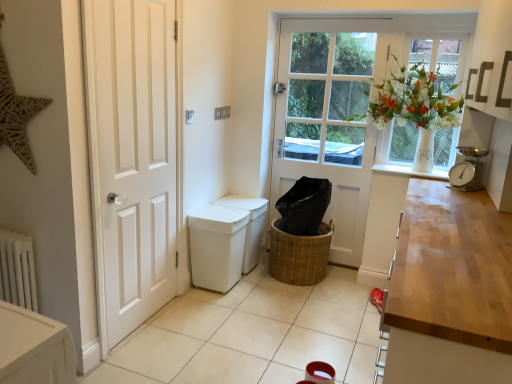
What is the approximate height of silver metallic scale at right?

It is 9.92 inches.

What do you see at coordinates (132, 157) in the screenshot? I see `white glossy door at left, the second door viewed from the right` at bounding box center [132, 157].

In order to face white glossy door at left, which ranks as the 1th door in left-to-right order, should I rotate leftwards or rightwards?

You should rotate left by 14.594 degrees.

Identify the location of white glass window at upper right. (421, 104).

Where is `woven brown basket at center`? The image size is (512, 384). woven brown basket at center is located at coordinates (298, 255).

What do you see at coordinates (17, 270) in the screenshot? The image size is (512, 384). I see `white matte radiator at lower left` at bounding box center [17, 270].

Image resolution: width=512 pixels, height=384 pixels. Identify the location of silver metallic scale at right. (468, 169).

Is white plastic bin at lower center positioned with its back to silver metallic scale at right?

white plastic bin at lower center is not turned away from silver metallic scale at right.

From the image's perspective, is white plastic bin at lower center over silver metallic scale at right?

No.

From a real-world perspective, relative to silver metallic scale at right, is white plastic bin at lower center vertically above or below?

In terms of real-world spatial position, white plastic bin at lower center is below silver metallic scale at right.

Based on the photo, does white plastic bin at lower center have a greater height compared to silver metallic scale at right?

Indeed, white plastic bin at lower center has a greater height compared to silver metallic scale at right.

Is white matte radiator at lower left at the left side of white plastic bin at lower center?

Yes.

Is white matte radiator at lower left closer to the viewer compared to white plastic bin at lower center?

Yes, it is.

Does point (19, 260) come closer to viewer compared to point (228, 280)?

That is True.

Is white matte radiator at lower left looking in the opposite direction of white plastic bin at lower center?

Yes, white plastic bin at lower center is at the back of white matte radiator at lower left.

From a real-world perspective, is silver metallic scale at right above or below white glossy door at left, the second door viewed from the right?

In terms of real-world spatial position, silver metallic scale at right is above white glossy door at left, the second door viewed from the right.

Which is closer to the camera, (478, 167) or (97, 101)?

The point (97, 101) is closer.

Is silver metallic scale at right oriented away from white glossy door at left, the second door viewed from the right?

No, white glossy door at left, the second door viewed from the right, is not at the back of silver metallic scale at right.

Between white glass window at upper right and white glossy door at left, which is counted as the first door, starting from the front, which one has larger width?

white glass window at upper right.

Considering the sizes of objects white glass window at upper right and white glossy door at left, which ranks as the 2th door in back-to-front order, in the image provided, who is bigger, white glass window at upper right or white glossy door at left, which ranks as the 2th door in back-to-front order,?

white glossy door at left, which ranks as the 2th door in back-to-front order.

Locate an element on the screen. The width and height of the screenshot is (512, 384). window on the right of white glossy door at left, the second door viewed from the right is located at coordinates (421, 104).

From the image's perspective, is white glass window at upper right located beneath white glossy door at left, the second door viewed from the right?

Actually, white glass window at upper right appears above white glossy door at left, the second door viewed from the right, in the image.

Does white glossy door at left, which ranks as the 1th door in left-to-right order, contain white glass window at upper right?

No, white glass window at upper right is located outside of white glossy door at left, which ranks as the 1th door in left-to-right order.

Is white glossy door at left, which is counted as the first door, starting from the front, oriented towards white glass window at upper right?

No, white glossy door at left, which is counted as the first door, starting from the front, is not turned towards white glass window at upper right.

Is point (163, 23) more distant than point (426, 56)?

No.

Is white tile at center taller or shorter than white glossy door at left, which ranks as the 2th door in back-to-front order?

Considering their sizes, white tile at center has less height than white glossy door at left, which ranks as the 2th door in back-to-front order.

How many degrees apart are the facing directions of white tile at center and white glossy door at left, the second door viewed from the right?

The facing directions of white tile at center and white glossy door at left, the second door viewed from the right, are 91.1 degrees apart.

Which object is further away from the camera taking this photo, white tile at center or white glossy door at left, which ranks as the 2th door in back-to-front order?

white glossy door at left, which ranks as the 2th door in back-to-front order.

Is white matte radiator at lower left not within silver metallic scale at right?

Indeed, white matte radiator at lower left is completely outside silver metallic scale at right.

Consider the image. Is white matte radiator at lower left turned away from silver metallic scale at right?

No, white matte radiator at lower left is not facing the opposite direction of silver metallic scale at right.

Is white matte radiator at lower left not close to silver metallic scale at right?

Yes, white matte radiator at lower left is far from silver metallic scale at right.

The width and height of the screenshot is (512, 384). Identify the location of sink on the left of silver metallic scale at right. (226, 241).

I want to click on sink above the white matte radiator at lower left (from the image's perspective), so click(x=226, y=241).

Based on the photo, considering their positions, is white tile at center positioned closer to white plastic bin at lower center than white glass window at upper right?

Based on the image, white tile at center appears to be nearer to white plastic bin at lower center.

When comparing their distances from white glossy door at left, which is counted as the first door, starting from the front, does white tile at center or white plastic bin at lower center seem further?

The object further to white glossy door at left, which is counted as the first door, starting from the front, is white tile at center.

In the scene shown: Based on their spatial positions, is silver metallic scale at right or white plastic bin at lower center closer to white glass window at upper right?

The object closer to white glass window at upper right is silver metallic scale at right.

In the scene shown: Looking at the image, which one is located closer to woven brown basket at center, white wooden door at center, arranged as the 1th door when viewed from the back, or white glossy door at left, which is counted as the first door, starting from the front?

white wooden door at center, arranged as the 1th door when viewed from the back.

In the scene shown: When comparing their distances from woven brown basket at center, does white plastic bin at lower center or white matte radiator at lower left seem further?

Among the two, white matte radiator at lower left is located further to woven brown basket at center.

Estimate the real-world distances between objects in this image. Which object is closer to woven brown basket at center, white glossy door at left, which ranks as the 2th door in back-to-front order, or white matte radiator at lower left?

white glossy door at left, which ranks as the 2th door in back-to-front order, is positioned closer to the anchor woven brown basket at center.

Based on their spatial positions, is white plastic bin at lower center or white glossy door at left, which ranks as the 2th door in back-to-front order, further from white tile at center?

white glossy door at left, which ranks as the 2th door in back-to-front order, is positioned further to the anchor white tile at center.

Looking at the image, which one is located further to white wooden door at center, arranged as the 1th door when viewed from the back, white tile at center or white plastic bin at lower center?

Among the two, white tile at center is located further to white wooden door at center, arranged as the 1th door when viewed from the back.

Identify the location of window located between white wooden door at center, marked as the second door in a left-to-right arrangement, and silver metallic scale at right in the left-right direction. The height and width of the screenshot is (384, 512). (421, 104).

The image size is (512, 384). I want to click on sink situated between white matte radiator at lower left and woven brown basket at center from left to right, so click(226, 241).

Image resolution: width=512 pixels, height=384 pixels. Identify the location of alarm clock between white glass window at upper right and white tile at center in the up-down direction. (468, 169).

You are a GUI agent. You are given a task and a screenshot of the screen. Output one action in this format:
    pyautogui.click(x=<x>, y=<y>)
    Task: Click on the sink situated between white matte radiator at lower left and silver metallic scale at right from left to right
    The width and height of the screenshot is (512, 384).
    Given the screenshot: What is the action you would take?
    [226, 241]